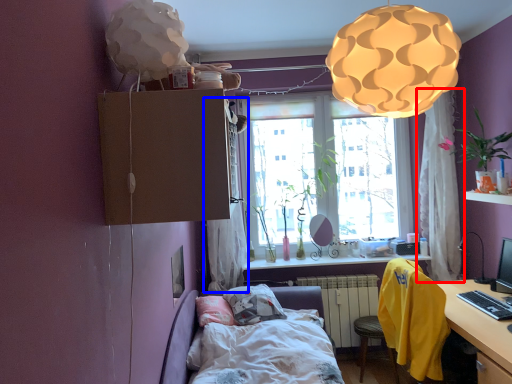
Question: Among these objects, which one is farthest to the camera, curtain (highlighted by a red box) or curtain (highlighted by a blue box)?

Choices:
 (A) curtain
 (B) curtain

Answer: (A)